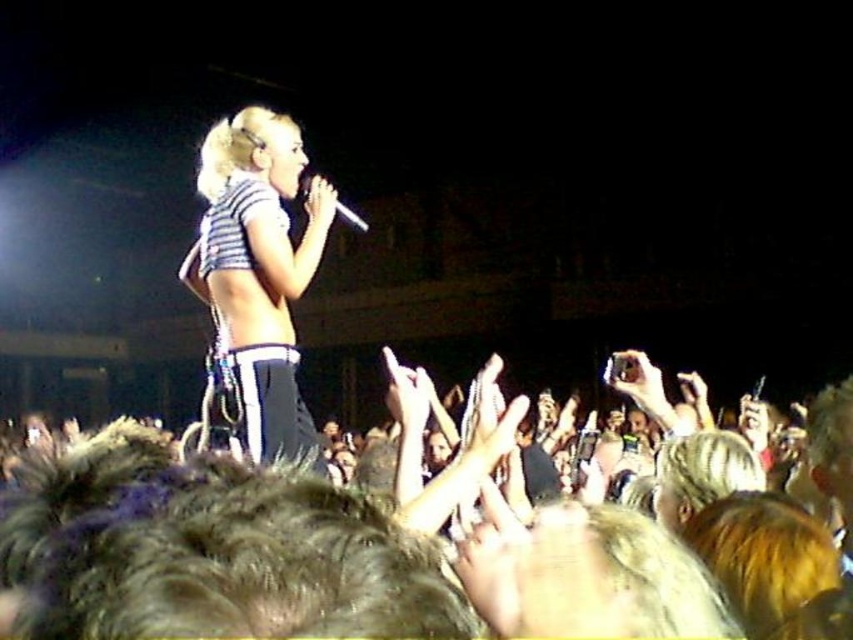
Question: Estimate the real-world distances between objects in this image. Which object is closer to the striped fabric bikini top at center?

Choices:
 (A) striped fabric top at center
 (B) shiny metallic microphone at center

Answer: (A)

Question: Among these objects, which one is farthest from the camera?

Choices:
 (A) shiny metallic microphone at center
 (B) striped fabric bikini top at center

Answer: (A)

Question: Does striped fabric top at center appear under striped fabric bikini top at center?

Choices:
 (A) no
 (B) yes

Answer: (B)

Question: Which of the following is the closest to the observer?

Choices:
 (A) (267, 240)
 (B) (280, 204)

Answer: (A)

Question: Does striped fabric top at center come in front of shiny metallic microphone at center?

Choices:
 (A) yes
 (B) no

Answer: (A)

Question: Does striped fabric top at center have a smaller size compared to striped fabric bikini top at center?

Choices:
 (A) no
 (B) yes

Answer: (A)